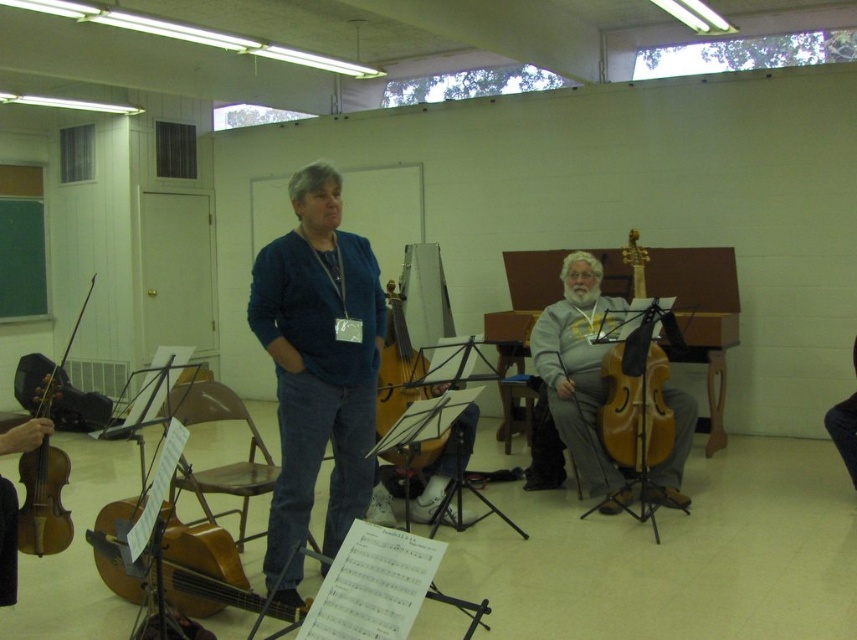
Question: Does wooden violin at center appear over wooden violin at left?

Choices:
 (A) no
 (B) yes

Answer: (B)

Question: Is gray fleece hoodie at center behind wooden violin at left?

Choices:
 (A) yes
 (B) no

Answer: (A)

Question: Estimate the real-world distances between objects in this image. Which object is closer to the wooden violin at center?

Choices:
 (A) golden wood cello at center
 (B) gray fleece hoodie at center
 (C) wooden violin at left

Answer: (B)

Question: Observing the image, what is the correct spatial positioning of gray fleece hoodie at center in reference to wooden violin at left?

Choices:
 (A) right
 (B) left

Answer: (A)

Question: Which object appears farthest from the camera in this image?

Choices:
 (A) metallic brown chair at center
 (B) gray fleece hoodie at center

Answer: (B)

Question: Which point is closer to the camera?

Choices:
 (A) wooden violin at center
 (B) metallic brown chair at center

Answer: (B)